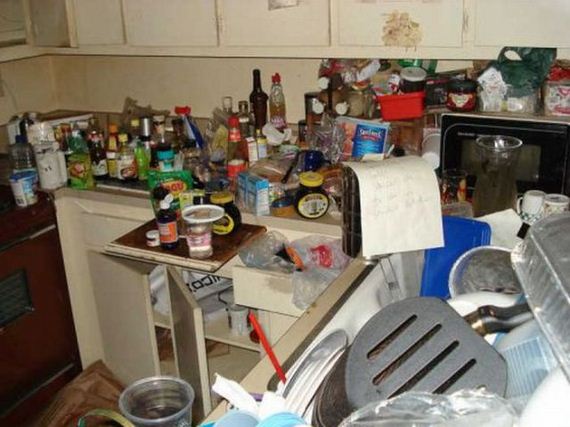
Find the location of a particular element. upper cabinet doors is located at coordinates (101, 19), (160, 23), (251, 23), (427, 18), (524, 23), (36, 27).